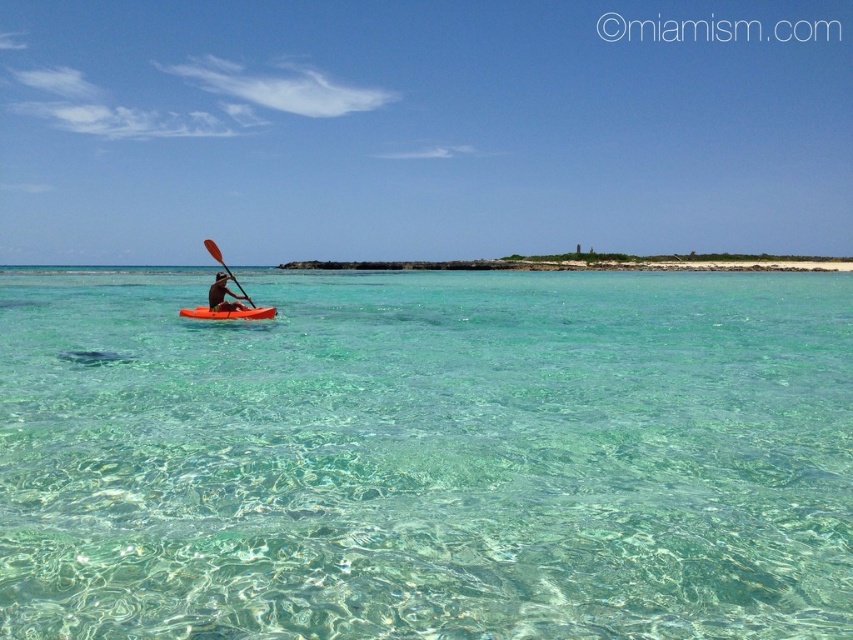
You are a drone operator trying to capture a photo of the two points in the coastal scene. The first point is labeled as point (225,305) and the second is point (218,259). Which point should you focus on first if you want to capture them in the order they appear from closest to farthest from your current position?

Point (225,305) is in front of point (218,259), so you should focus on point (225,305) first as it is closer to your current position.

You are standing at point A with coordinates point A at (264, 307). You want to reach point B, which is located at 0.650, 0.420. Given that the distance between these two points is 29.49 meters, can you estimate how far you need to travel to reach point B from point A?

The distance between point A at (264, 307) and point B at 0.650, 0.420 is 29.49 meters, so you need to travel approximately 29.49 meters to reach point B from point A.

You are a drone operator trying to capture a photo of the matte orange kayak at center. The drone is currently at the point marked by coordinates point (223, 296). Is the drone directly above the matte orange kayak at center?

Yes, the point (223, 296) marks the location of the matte orange kayak at center, so the drone is directly above it.